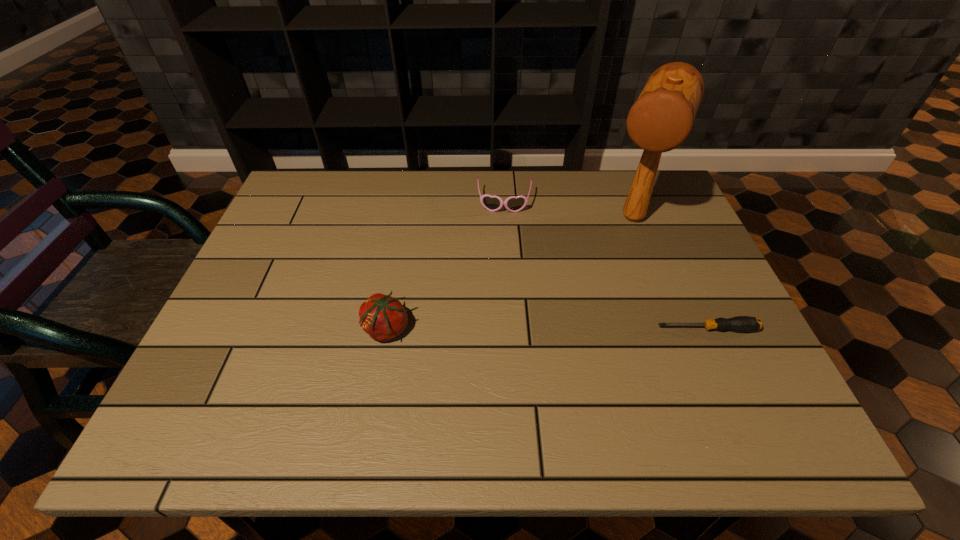
Where is `free space on the desktop that is between the tomato and the shortest object and is positioned on the strike surface of the tallest object`? free space on the desktop that is between the tomato and the shortest object and is positioned on the strike surface of the tallest object is located at coordinates (586, 329).

Identify the location of vacant spot on the desktop that is between the tomato and the screwdriver and is positioned on the front-facing side of the second object from left to right. This screenshot has width=960, height=540. (500, 329).